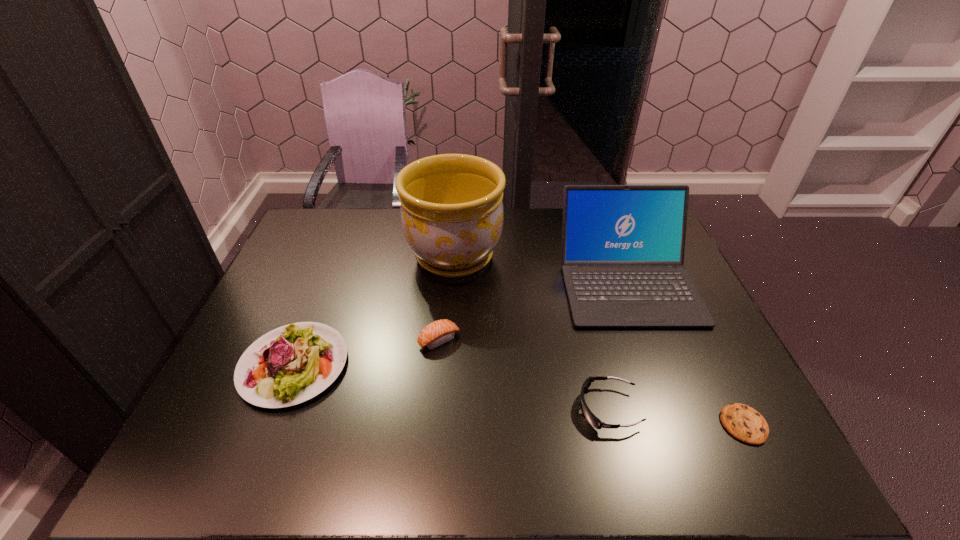
This screenshot has width=960, height=540. What are the coordinates of `free space that satisfies the following two spatial constraints: 1. on the screen of the shortest object; 2. on the right side of the second tallest object` in the screenshot? It's located at pos(681,424).

This screenshot has height=540, width=960. Identify the location of vacant space that satisfies the following two spatial constraints: 1. on the front and sides of the shortest object; 2. on the right side of the goggles. (612, 424).